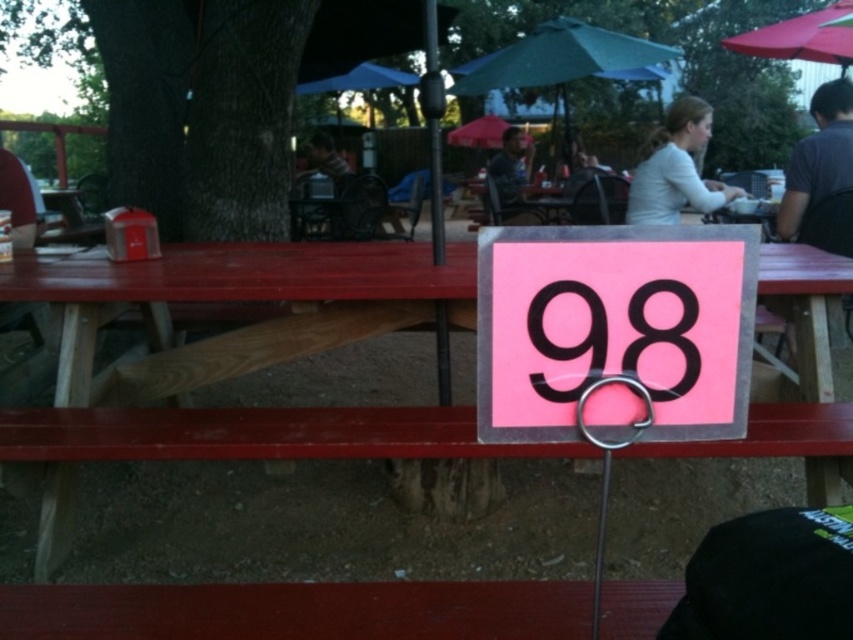
You are sitting at the picnic table and want to read the pink matte sign at center. There is a person wearing a dark gray shirt at right sitting between you and the sign. Can you see the sign clearly?

The pink matte sign at center is closer to the viewer than the dark gray shirt at right, so you can see the sign clearly without obstruction.

You are standing at the entrance of the outdoor seating area and want to find table 98. According to the image, where is the pink matte sign at center located in relation to the entrance?

The pink matte sign at center is located at point (567, 346), which means it is positioned approximately in the center of the seating area, likely making it easy to spot from the entrance.

You are a customer looking for a table under an umbrella. You see the green fabric umbrella at upper center and the matte black shirt at upper center. Which object is positioned higher in the scene?

The green fabric umbrella at upper center is located above the matte black shirt at upper center, so it is positioned higher in the scene.